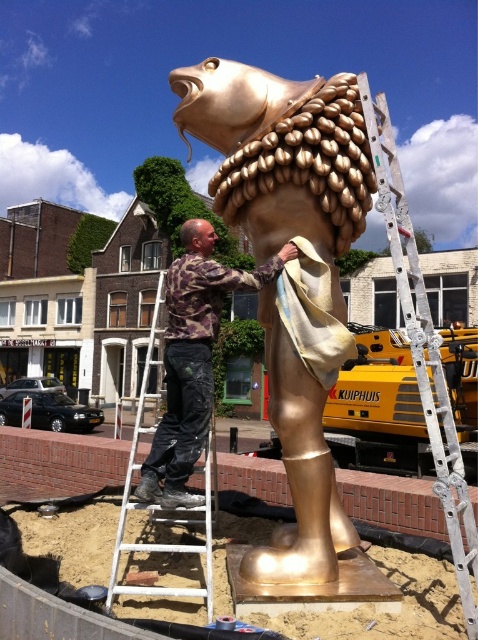
You are a safety inspector observing the scene. The camouflage fabric at center is hanging from a tree branch. The white metal ladder at center is placed near the sculpture. According to safety guidelines, the ladder must be positioned so that no objects are above it. Is the current setup compliant with safety standards?

The camouflage fabric at center is above the white metal ladder at center, so the setup does not comply with safety standards as there is an object overhead.